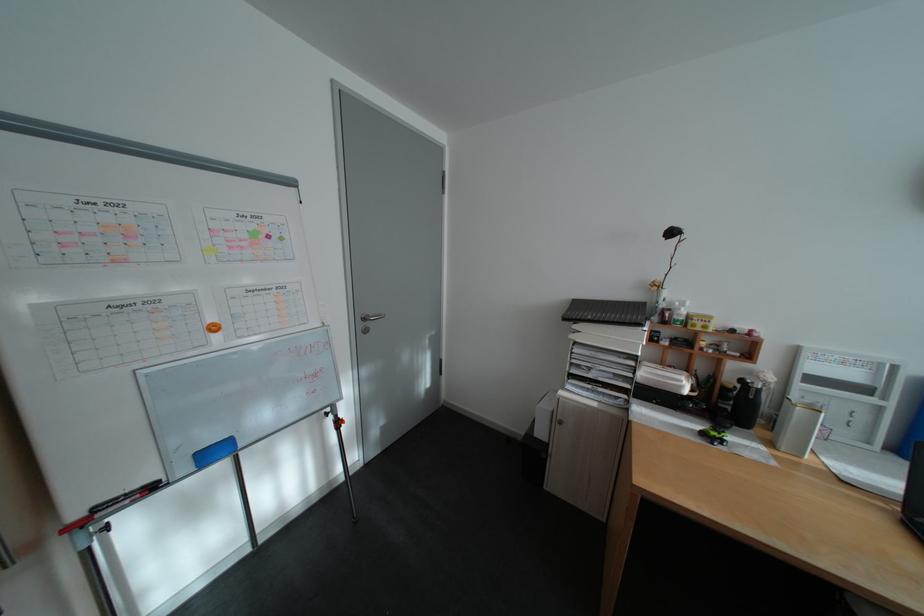
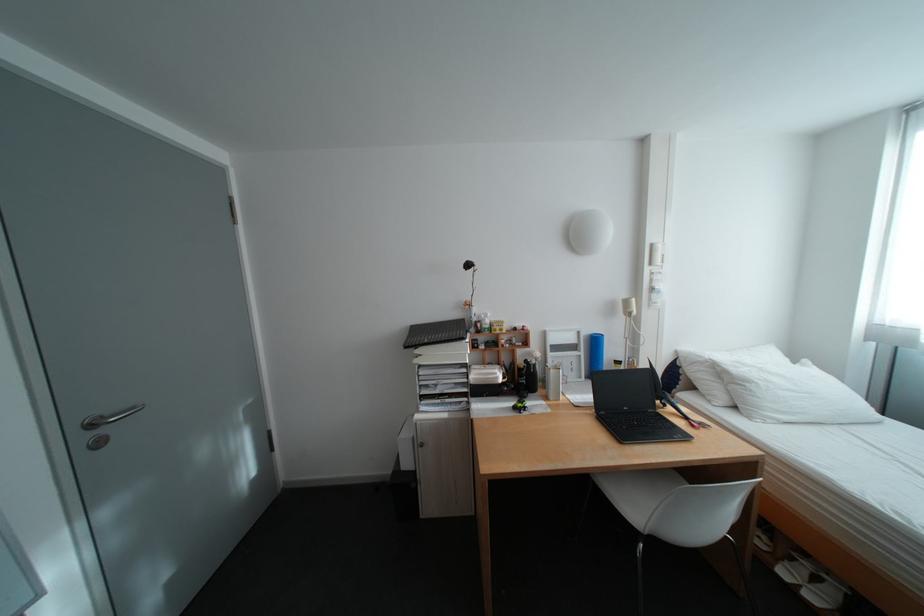
The point at (x=784, y=382) is marked in the first image. Where is the corresponding point in the second image?

(552, 358)